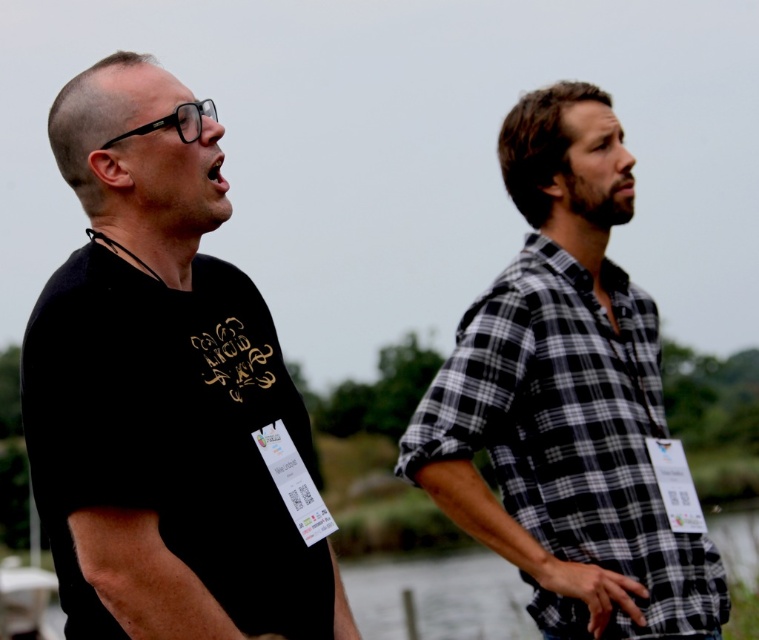
Question: Which is nearer to the black checkered shirt at right?

Choices:
 (A) clear water at lower center
 (B) black matte t-shirt at left

Answer: (B)

Question: Is black matte t-shirt at left bigger than clear water at lower center?

Choices:
 (A) no
 (B) yes

Answer: (A)

Question: Among these objects, which one is nearest to the camera?

Choices:
 (A) black checkered shirt at right
 (B) black matte t-shirt at left
 (C) clear water at lower center

Answer: (B)

Question: In this image, where is black matte t-shirt at left located relative to clear water at lower center?

Choices:
 (A) right
 (B) left

Answer: (B)

Question: Is black checkered shirt at right to the right of clear water at lower center from the viewer's perspective?

Choices:
 (A) yes
 (B) no

Answer: (B)

Question: Which point is farther from the camera taking this photo?

Choices:
 (A) (93, 337)
 (B) (591, 307)

Answer: (B)